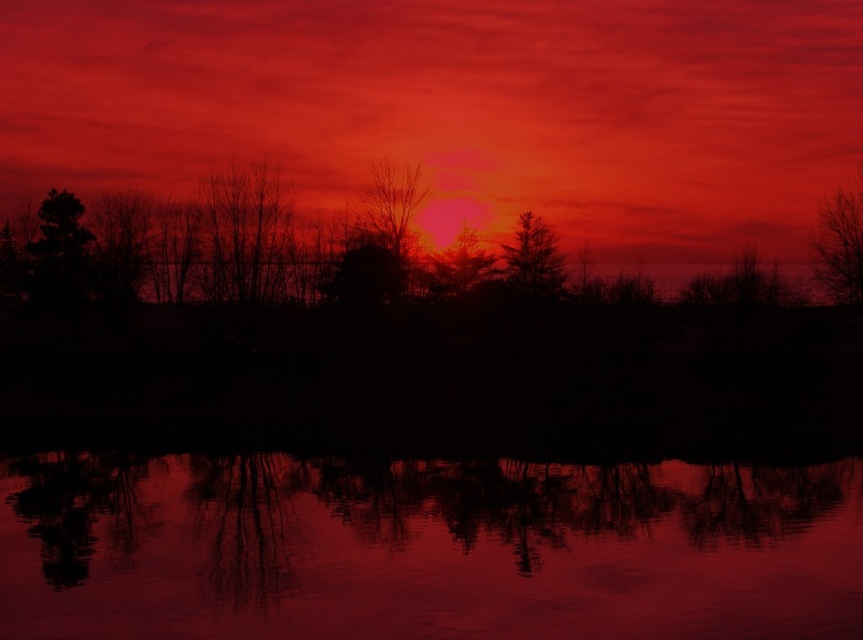
Does matte red sky at center appear on the left side of glossy water at center?

Indeed, matte red sky at center is positioned on the left side of glossy water at center.

Which is behind, point (572, 246) or point (706, 636)?

The point (572, 246) is behind.

Measure the distance between matte red sky at center and camera.

A distance of 65.94 meters exists between matte red sky at center and camera.

Find the location of a particular element. Image resolution: width=863 pixels, height=640 pixels. matte red sky at center is located at coordinates (455, 108).

Who is more forward, (855,195) or (441,280)?

Point (441,280)

Is silhouette bare tree at right smaller than matte red tree at center?

Correct, silhouette bare tree at right occupies less space than matte red tree at center.

Between point (830, 280) and point (452, 276), which one is positioned behind?

The point (830, 280) is behind.

At what (x,y) coordinates should I click in order to perform the action: click on silhouette bare tree at right. Please return your answer as a coordinate pair (x, y). Looking at the image, I should click on (839, 244).

Does glossy water at center have a smaller size compared to silhouette coniferous tree at center?

No, glossy water at center is not smaller than silhouette coniferous tree at center.

Can you confirm if glossy water at center is taller than silhouette coniferous tree at center?

No.

Between point (783, 572) and point (553, 294), which one is positioned behind?

Positioned behind is point (553, 294).

Where is `glossy water at center`? glossy water at center is located at coordinates (425, 548).